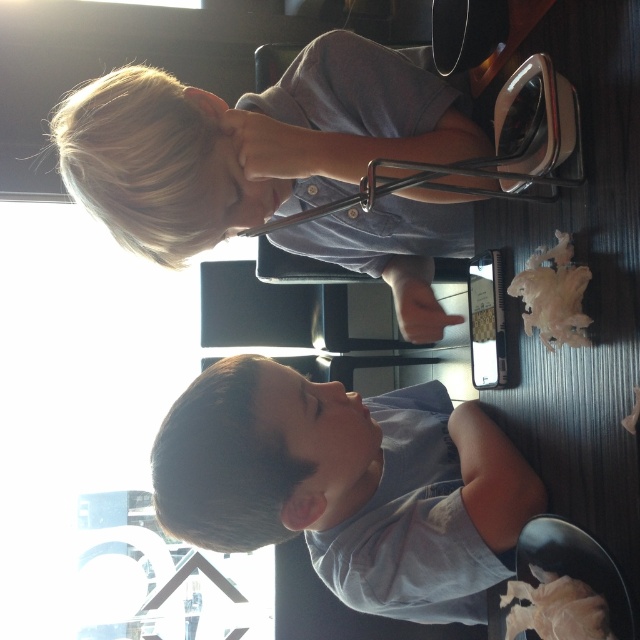
Question: Can you confirm if light brown hair at upper left is thinner than gray cotton shirt at lower center?

Choices:
 (A) yes
 (B) no

Answer: (B)

Question: From the image, what is the correct spatial relationship of light brown hair at upper left in relation to gray cotton shirt at lower center?

Choices:
 (A) above
 (B) below

Answer: (A)

Question: Among these objects, which one is nearest to the camera?

Choices:
 (A) short dark hair at lower left
 (B) light brown hair at upper left

Answer: (B)

Question: Is light brown hair at upper left above short dark hair at lower left?

Choices:
 (A) no
 (B) yes

Answer: (B)

Question: Estimate the real-world distances between objects in this image. Which object is farther from the light brown hair at upper left?

Choices:
 (A) short dark hair at lower left
 (B) gray cotton shirt at lower center

Answer: (A)

Question: Based on their relative distances, which object is nearer to the short dark hair at lower left?

Choices:
 (A) gray cotton shirt at lower center
 (B) light brown hair at upper left

Answer: (A)